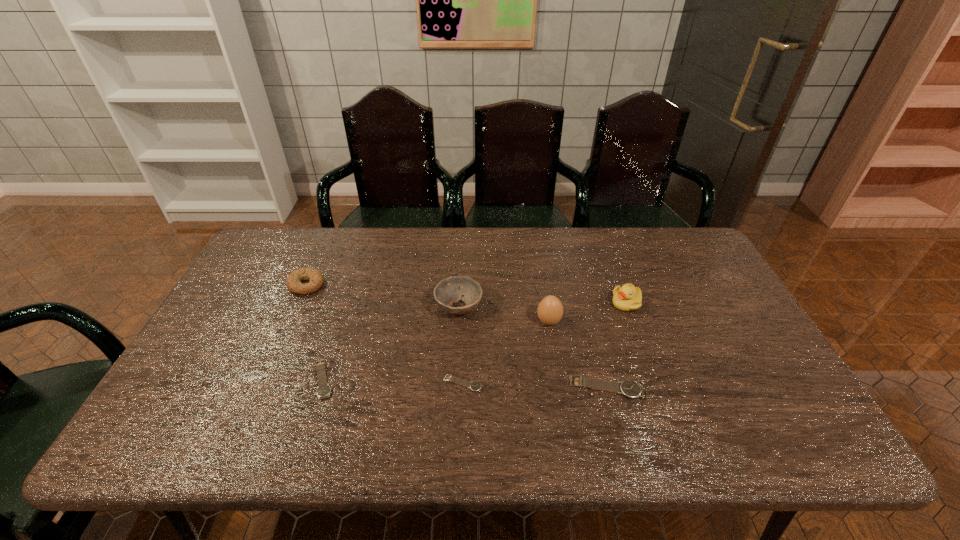
In order to click on the sixth object from right to left in this screenshot , I will do `click(323, 391)`.

Identify the location of the second tallest watch. (323, 391).

Locate an element on the screen. The image size is (960, 540). the second watch from right to left is located at coordinates (475, 386).

I want to click on the shortest object, so click(475, 386).

At what (x,y) coordinates should I click in order to perform the action: click on the tallest watch. Please return your answer as a coordinate pair (x, y). Looking at the image, I should click on (630, 389).

Identify the location of the rightmost watch. (630, 389).

In order to click on bagel in this screenshot , I will do `click(316, 279)`.

The width and height of the screenshot is (960, 540). I want to click on the fourth shortest object, so click(x=316, y=279).

Locate an element on the screen. duckling is located at coordinates (628, 297).

This screenshot has height=540, width=960. In order to click on bowl in this screenshot , I will do `click(448, 291)`.